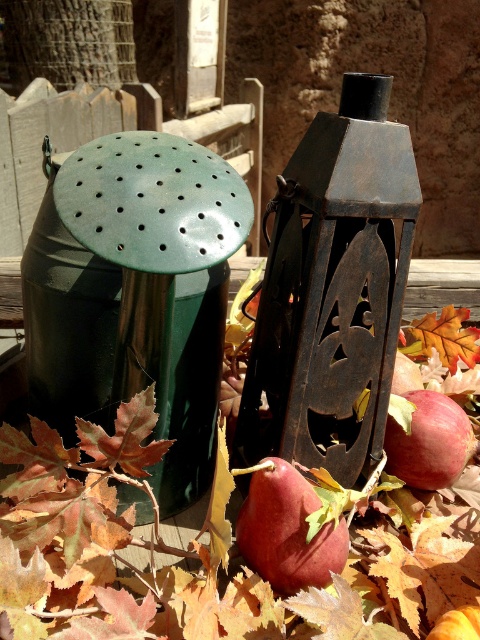
Question: From the image, what is the correct spatial relationship of shiny red apple at center in relation to orange matte maple leaf at lower right?

Choices:
 (A) right
 (B) left

Answer: (B)

Question: Is matte red apple at lower right below orange matte maple leaf at lower right?

Choices:
 (A) yes
 (B) no

Answer: (A)

Question: Estimate the real-world distances between objects in this image. Which object is closer to the orange matte maple leaf at lower right?

Choices:
 (A) shiny red apple at center
 (B) matte red apple at lower right

Answer: (B)

Question: Is shiny red apple at center in front of matte red apple at lower right?

Choices:
 (A) no
 (B) yes

Answer: (B)

Question: Which point is closer to the camera taking this photo?

Choices:
 (A) (303, 508)
 (B) (453, 364)
 (C) (455, 472)

Answer: (A)

Question: Which object is positioned farthest from the matte red apple at lower right?

Choices:
 (A) orange matte maple leaf at lower right
 (B) shiny red apple at center

Answer: (A)